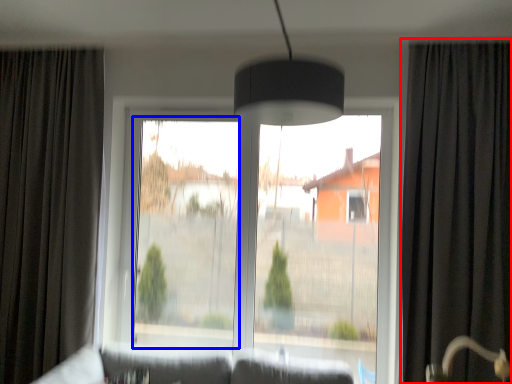
Question: Which object appears closest to the camera in this image, curtain (highlighted by a red box) or window screen (highlighted by a blue box)?

Choices:
 (A) curtain
 (B) window screen

Answer: (A)